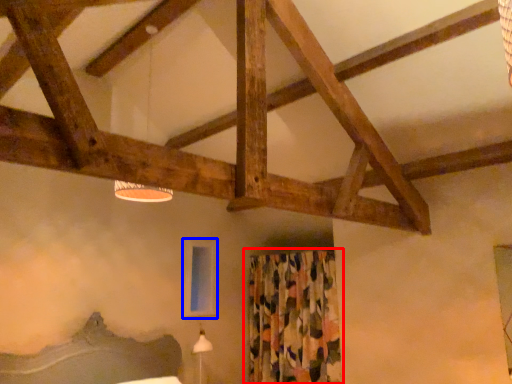
Question: Which of the following is the closest to the observer, curtain (highlighted by a red box) or window screen (highlighted by a blue box)?

Choices:
 (A) curtain
 (B) window screen

Answer: (A)